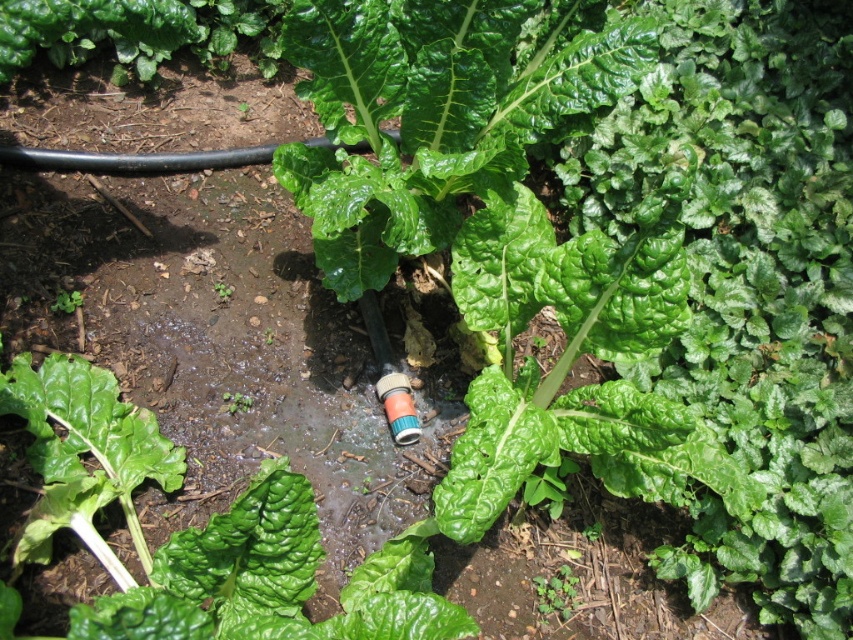
Question: Considering the relative positions of green leafy plant at upper left and green leafy plant at lower left in the image provided, where is green leafy plant at upper left located with respect to green leafy plant at lower left?

Choices:
 (A) below
 (B) above

Answer: (B)

Question: Is green leafy at center positioned at the back of green leafy plant at lower left?

Choices:
 (A) yes
 (B) no

Answer: (B)

Question: Which of the following is the closest to the observer?

Choices:
 (A) green leafy plant at upper left
 (B) green leafy plant at lower left

Answer: (B)

Question: Can you confirm if green leafy at center is bigger than green leafy plant at lower left?

Choices:
 (A) no
 (B) yes

Answer: (B)

Question: Which object is positioned farthest from the green leafy plant at lower left?

Choices:
 (A) green leafy at center
 (B) green leafy plant at upper left

Answer: (A)

Question: Which of these objects is positioned farthest from the green leafy at center?

Choices:
 (A) green leafy plant at upper left
 (B) green leafy plant at lower left

Answer: (A)